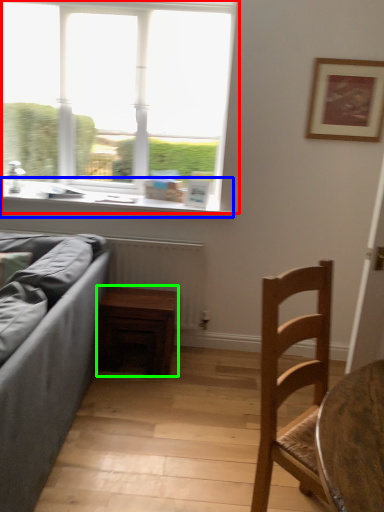
Question: Based on their relative distances, which object is nearer to window (highlighted by a red box)? Choose from window sill (highlighted by a blue box) and table (highlighted by a green box).

Choices:
 (A) window sill
 (B) table

Answer: (A)